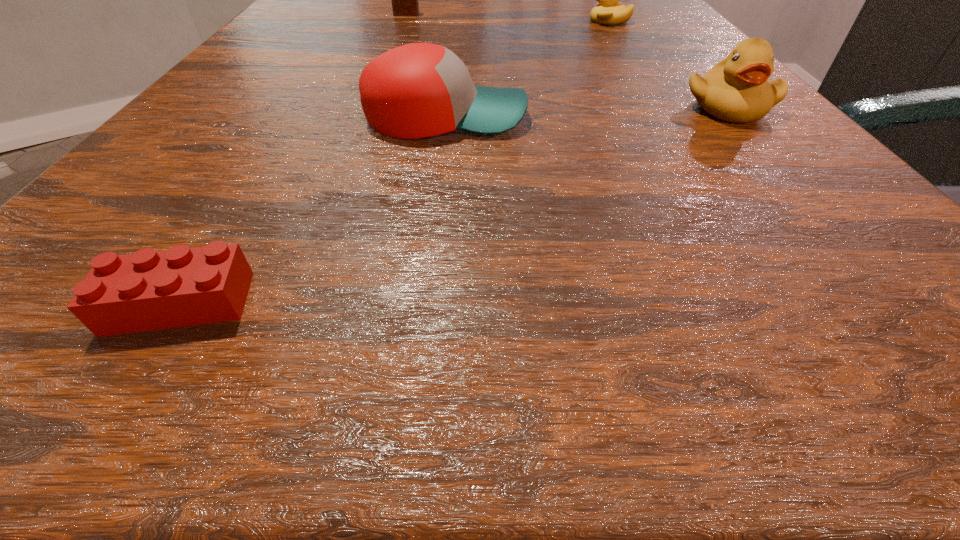
Image resolution: width=960 pixels, height=540 pixels. Find the location of `free region at the far edge of the desktop`. free region at the far edge of the desktop is located at coordinates (455, 19).

The image size is (960, 540). Identify the location of free space at the near edge. (584, 346).

The height and width of the screenshot is (540, 960). In order to click on vacant space at the left edge of the desktop in this screenshot , I will do `click(251, 194)`.

You are a GUI agent. You are given a task and a screenshot of the screen. Output one action in this format:
    pyautogui.click(x=<x>, y=<y>)
    Task: Click on the free location at the right edge
    
    Given the screenshot: What is the action you would take?
    pyautogui.click(x=709, y=63)

This screenshot has height=540, width=960. Find the location of `blank area at the far left corner`. blank area at the far left corner is located at coordinates (282, 28).

Where is `vacant space at the far right corner of the desktop`? This screenshot has height=540, width=960. vacant space at the far right corner of the desktop is located at coordinates (677, 24).

You are a GUI agent. You are given a task and a screenshot of the screen. Output one action in this format:
    pyautogui.click(x=<x>, y=<y>)
    Task: Click on the free spot between the nearer duckling and the padlock
    This screenshot has width=960, height=540.
    Given the screenshot: What is the action you would take?
    pyautogui.click(x=566, y=61)

You are a GUI agent. You are given a task and a screenshot of the screen. Output one action in this format:
    pyautogui.click(x=<x>, y=<y>)
    Task: Click on the unoccupied area between the baseball cap and the leftmost object
    
    Given the screenshot: What is the action you would take?
    pyautogui.click(x=313, y=210)

Locate an element on the screen. Image resolution: width=960 pixels, height=540 pixels. free space between the baseball cap and the second shortest object is located at coordinates pyautogui.click(x=528, y=69).

Where is `free area in between the padlock and the taller duckling`? The width and height of the screenshot is (960, 540). free area in between the padlock and the taller duckling is located at coordinates (566, 61).